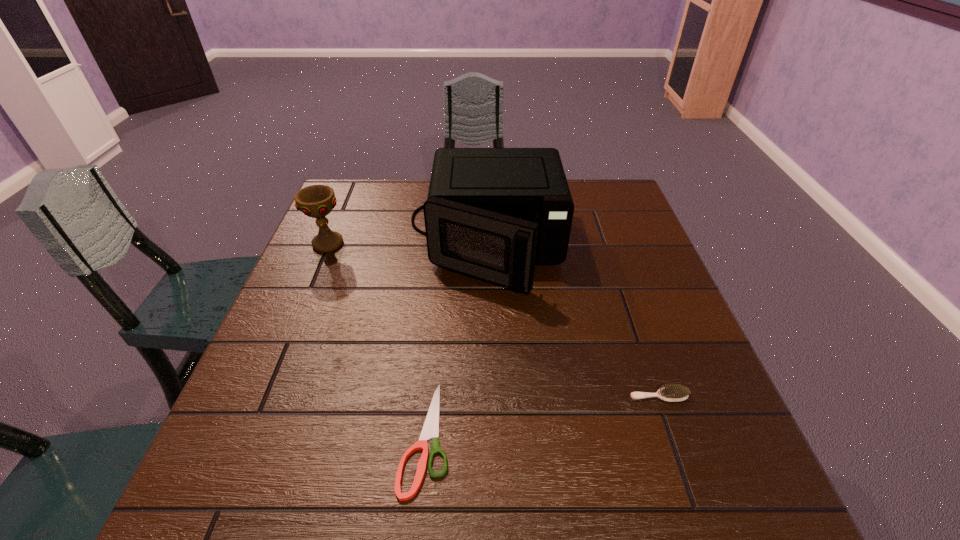
The height and width of the screenshot is (540, 960). Find the location of `free space that is in between the tallest object and the scrubbing brush`. free space that is in between the tallest object and the scrubbing brush is located at coordinates (573, 321).

The height and width of the screenshot is (540, 960). I want to click on object that is the third closest one to the shortest object, so click(316, 201).

In order to click on object that stands as the third closest to the rightmost object in this screenshot , I will do `click(316, 201)`.

Image resolution: width=960 pixels, height=540 pixels. What are the coordinates of `free space that satisfies the following two spatial constraints: 1. with the door open on the microwave oven; 2. on the left side of the third tallest object` in the screenshot? It's located at (490, 396).

Find the location of a particular element. The image size is (960, 540). free space that satisfies the following two spatial constraints: 1. with the door open on the second shortest object; 2. on the right side of the tallest object is located at coordinates (490, 396).

You are a GUI agent. You are given a task and a screenshot of the screen. Output one action in this format:
    pyautogui.click(x=<x>, y=<y>)
    Task: Click on the free location that satisfies the following two spatial constraints: 1. on the front side of the second shortest object; 2. on the left side of the chalice
    
    Given the screenshot: What is the action you would take?
    pyautogui.click(x=265, y=396)